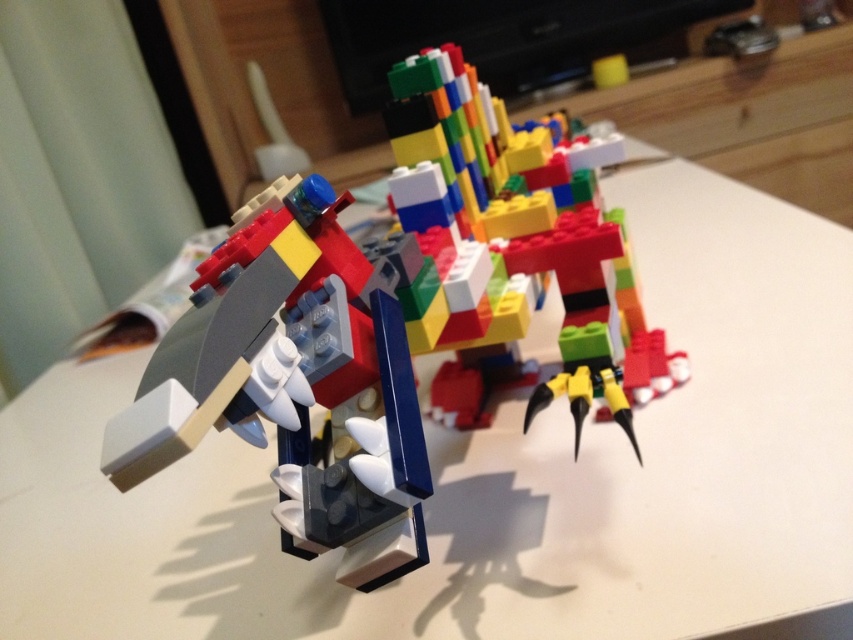
Is the position of matte plastic lego dragon at center less distant than that of multicolored plastic blocks at center?

Yes.

Is matte plastic lego dragon at center taller than multicolored plastic blocks at center?

Incorrect, matte plastic lego dragon at center's height is not larger of multicolored plastic blocks at center's.

Find the location of `matte plastic lego dragon at center`. matte plastic lego dragon at center is located at coordinates [x=293, y=385].

Find the location of a particular element. Image resolution: width=853 pixels, height=640 pixels. matte plastic lego dragon at center is located at coordinates (293, 385).